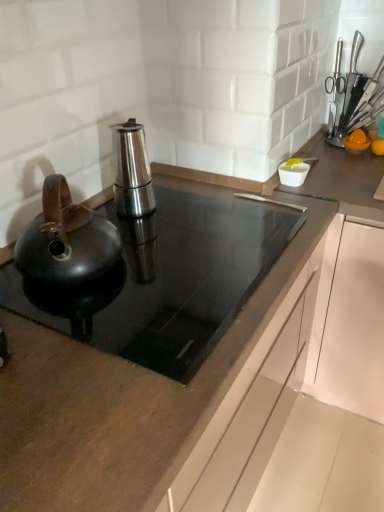
Question: Does stainless steel espresso maker at center, which is the 1th kitchen appliance in back-to-front order, appear on the left side of shiny black kettle at left, marked as the first kitchen appliance in a front-to-back arrangement?

Choices:
 (A) no
 (B) yes

Answer: (A)

Question: Is stainless steel espresso maker at center, positioned as the second kitchen appliance in front-to-back order, to the right of shiny black kettle at left, positioned as the second kitchen appliance in back-to-front order, from the viewer's perspective?

Choices:
 (A) no
 (B) yes

Answer: (B)

Question: Is the depth of stainless steel espresso maker at center, positioned as the second kitchen appliance in front-to-back order, less than that of shiny black kettle at left, marked as the first kitchen appliance in a front-to-back arrangement?

Choices:
 (A) no
 (B) yes

Answer: (A)

Question: From a real-world perspective, is stainless steel espresso maker at center, which is the 1th kitchen appliance in back-to-front order, beneath shiny black kettle at left, positioned as the second kitchen appliance in back-to-front order?

Choices:
 (A) no
 (B) yes

Answer: (A)

Question: Is shiny black kettle at left, positioned as the second kitchen appliance in back-to-front order, surrounded by stainless steel espresso maker at center, positioned as the second kitchen appliance in front-to-back order?

Choices:
 (A) no
 (B) yes

Answer: (A)

Question: Is black glass cooktop at center situated inside metallic knife block at upper right or outside?

Choices:
 (A) inside
 (B) outside

Answer: (B)

Question: Based on their positions, is black glass cooktop at center located to the left or right of metallic knife block at upper right?

Choices:
 (A) right
 (B) left

Answer: (B)

Question: From a real-world perspective, is black glass cooktop at center positioned above or below metallic knife block at upper right?

Choices:
 (A) above
 (B) below

Answer: (B)

Question: Is point (102, 337) positioned closer to the camera than point (367, 114)?

Choices:
 (A) closer
 (B) farther

Answer: (A)

Question: Relative to shiny black kettle at left, marked as the first kitchen appliance in a front-to-back arrangement, is metallic knife block at upper right in front or behind?

Choices:
 (A) front
 (B) behind

Answer: (B)

Question: From the image's perspective, is metallic knife block at upper right positioned above or below shiny black kettle at left, positioned as the second kitchen appliance in back-to-front order?

Choices:
 (A) above
 (B) below

Answer: (A)

Question: From their relative heights in the image, would you say metallic knife block at upper right is taller or shorter than shiny black kettle at left, positioned as the second kitchen appliance in back-to-front order?

Choices:
 (A) short
 (B) tall

Answer: (B)

Question: Is metallic knife block at upper right inside or outside of shiny black kettle at left, positioned as the second kitchen appliance in back-to-front order?

Choices:
 (A) outside
 (B) inside

Answer: (A)

Question: From the image's perspective, is metallic knife block at upper right positioned above or below stainless steel espresso maker at center, which is the 1th kitchen appliance in back-to-front order?

Choices:
 (A) below
 (B) above

Answer: (B)

Question: Would you say metallic knife block at upper right is inside or outside stainless steel espresso maker at center, positioned as the second kitchen appliance in front-to-back order?

Choices:
 (A) outside
 (B) inside

Answer: (A)